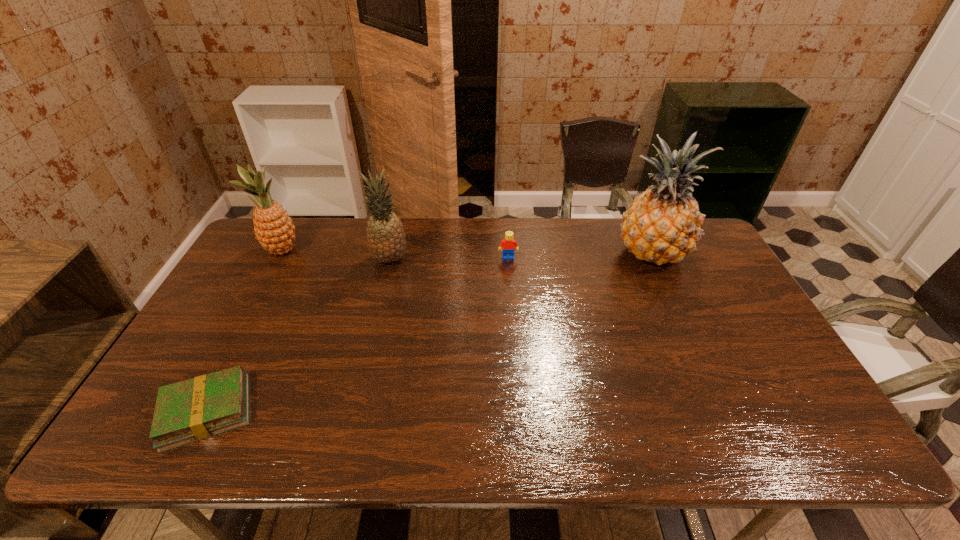
Image resolution: width=960 pixels, height=540 pixels. What are the coordinates of `vacant space located 0.130m on the face of the Lego` in the screenshot? It's located at (511, 287).

What are the coordinates of `Lego that is at the far edge` in the screenshot? It's located at (508, 243).

Where is `object at the near edge`? The width and height of the screenshot is (960, 540). object at the near edge is located at coordinates 195,409.

At what (x,y) coordinates should I click in order to perform the action: click on pineapple situated at the left edge. Please return your answer as a coordinate pair (x, y). The height and width of the screenshot is (540, 960). Looking at the image, I should click on pyautogui.click(x=274, y=229).

At what (x,y) coordinates should I click in order to perform the action: click on book that is at the left edge. Please return your answer as a coordinate pair (x, y). The image size is (960, 540). Looking at the image, I should click on (195, 409).

Locate an element on the screen. This screenshot has width=960, height=540. object that is at the right edge is located at coordinates (663, 224).

Locate an element on the screen. The image size is (960, 540). object positioned at the far left corner is located at coordinates (274, 229).

At what (x,y) coordinates should I click in order to perform the action: click on object that is at the near left corner. Please return your answer as a coordinate pair (x, y). Image resolution: width=960 pixels, height=540 pixels. Looking at the image, I should click on (195, 409).

I want to click on object that is at the far right corner, so click(663, 224).

In the image, there is a desktop. Where is `free region at the far edge`? Image resolution: width=960 pixels, height=540 pixels. free region at the far edge is located at coordinates (334, 242).